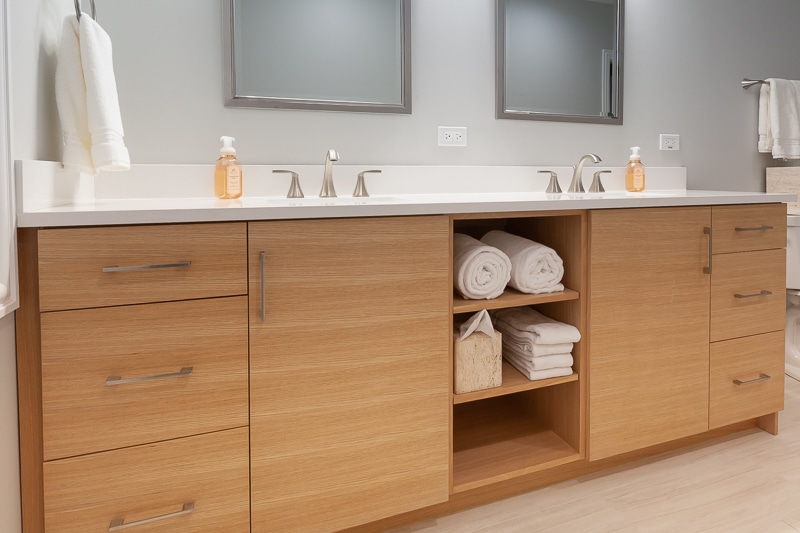
Identify the location of tissue box. The height and width of the screenshot is (533, 800). (470, 351).